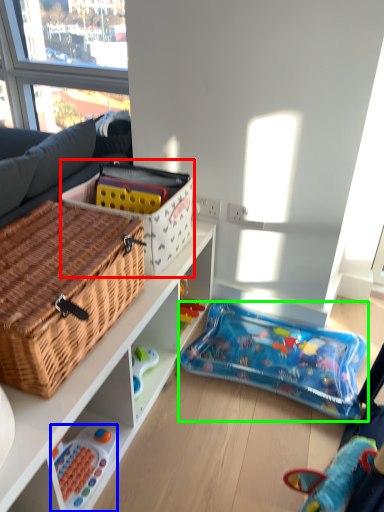
Question: Estimate the real-world distances between objects in this image. Which object is closer to cardboard box (highlighted by a red box), toy (highlighted by a blue box) or toy (highlighted by a green box)?

Choices:
 (A) toy
 (B) toy

Answer: (B)